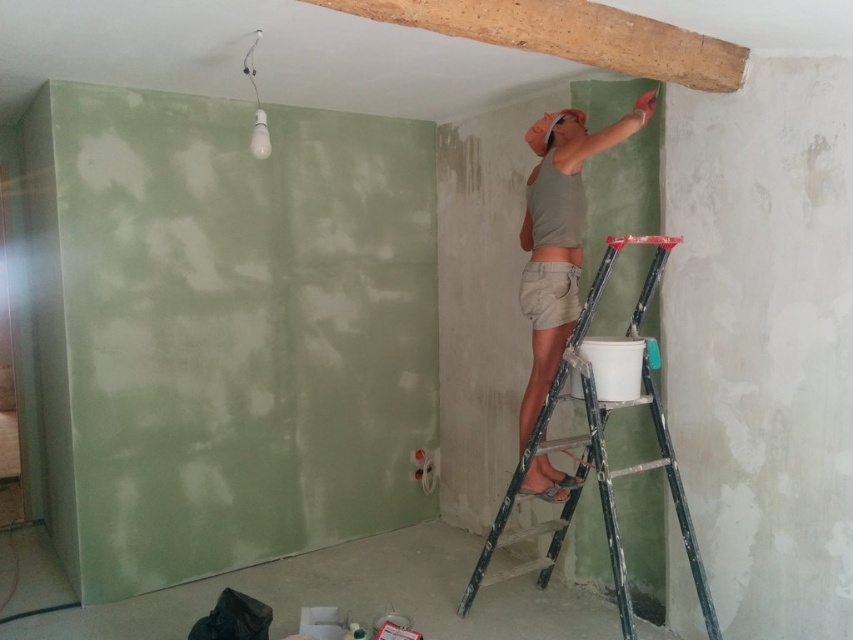
Question: Is wooden beam at upper center below matte green shorts at center?

Choices:
 (A) yes
 (B) no

Answer: (B)

Question: Considering the relative positions of wooden beam at upper center and matte green shorts at center in the image provided, where is wooden beam at upper center located with respect to matte green shorts at center?

Choices:
 (A) below
 (B) above

Answer: (B)

Question: Does wooden beam at upper center come behind matte green shorts at center?

Choices:
 (A) yes
 (B) no

Answer: (B)

Question: Estimate the real-world distances between objects in this image. Which object is closer to the metallic silver ladder at upper right?

Choices:
 (A) matte green shorts at center
 (B) wooden beam at upper center

Answer: (A)

Question: Among these objects, which one is nearest to the camera?

Choices:
 (A) metallic silver ladder at upper right
 (B) matte green shorts at center
 (C) wooden beam at upper center

Answer: (C)

Question: Which point is closer to the camera taking this photo?

Choices:
 (A) (717, 636)
 (B) (523, 268)
 (C) (619, 48)

Answer: (C)